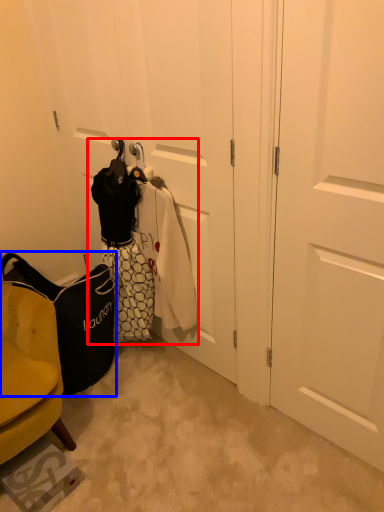
Question: Which of the following is the farthest to the observer, laundry (highlighted by a red box) or handbag (highlighted by a blue box)?

Choices:
 (A) laundry
 (B) handbag

Answer: (B)